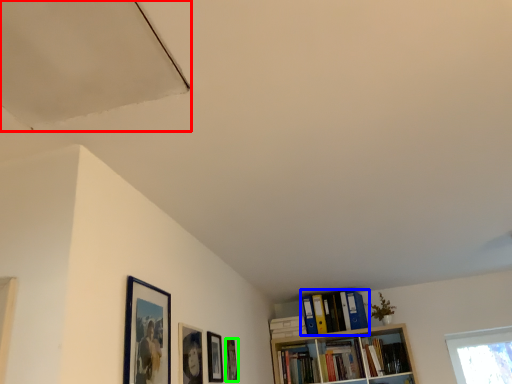
Question: Which is nearer to the exhaust hood (highlighted by a red box)? book (highlighted by a blue box) or picture frame (highlighted by a green box).

Choices:
 (A) book
 (B) picture frame

Answer: (B)